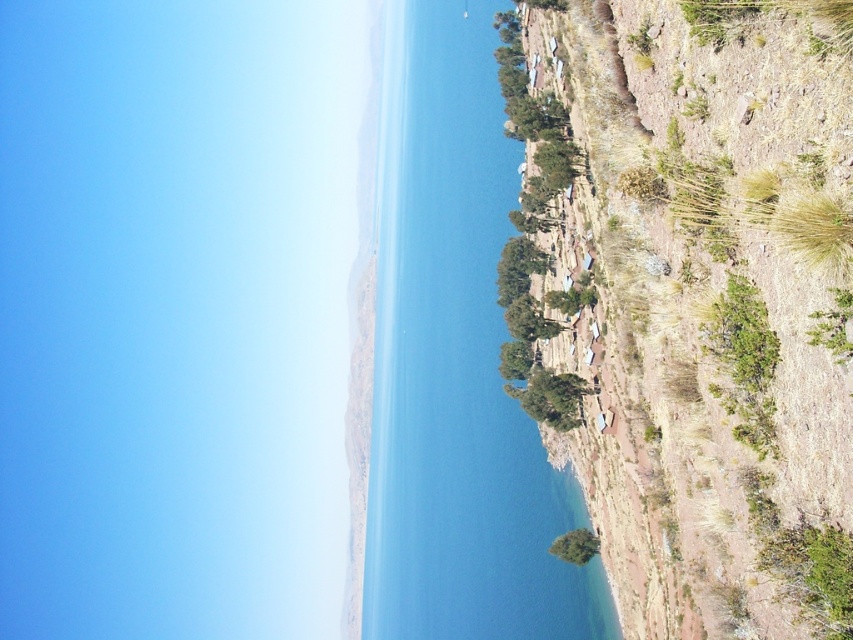
Is point (367, 580) positioned after point (555, 554)?

Yes, point (367, 580) is behind point (555, 554).

Based on the photo, can you confirm if blue water at center is bigger than green leafy bush at lower center?

Yes.

Does point (364, 582) come farther from viewer compared to point (575, 529)?

Yes, it is behind point (575, 529).

Find the location of a particular element. blue water at center is located at coordinates tap(456, 364).